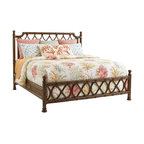
Find the location of `oversized pillow`. oversized pillow is located at coordinates (33, 50), (33, 40), (49, 42), (52, 51), (63, 51), (68, 43), (73, 46).